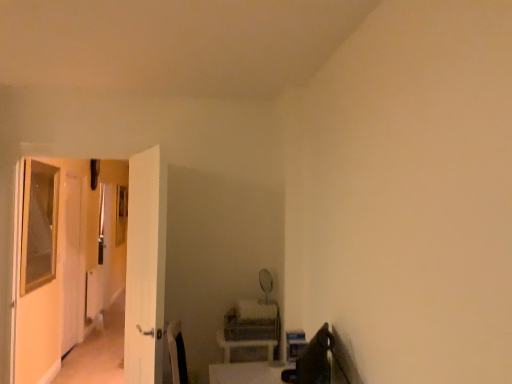
Question: Does green fabric swivel chair at lower right have a smaller size compared to white glossy door at left, which is the second screen door in back-to-front order?

Choices:
 (A) yes
 (B) no

Answer: (A)

Question: From a real-world perspective, is green fabric swivel chair at lower right positioned over white glossy door at left, which is the second screen door in back-to-front order, based on gravity?

Choices:
 (A) no
 (B) yes

Answer: (A)

Question: Is green fabric swivel chair at lower right turned away from white glossy door at left, which is the second screen door in back-to-front order?

Choices:
 (A) yes
 (B) no

Answer: (B)

Question: Considering the relative sizes of green fabric swivel chair at lower right and white glossy door at left, placed as the first screen door when sorted from front to back, in the image provided, is green fabric swivel chair at lower right thinner than white glossy door at left, placed as the first screen door when sorted from front to back,?

Choices:
 (A) yes
 (B) no

Answer: (B)

Question: Is there a large distance between green fabric swivel chair at lower right and white glossy door at left, which is the second screen door in back-to-front order?

Choices:
 (A) no
 (B) yes

Answer: (A)

Question: Do you think green fabric swivel chair at lower right is within white glossy table at lower center, or outside of it?

Choices:
 (A) outside
 (B) inside

Answer: (A)

Question: Considering the positions of green fabric swivel chair at lower right and white glossy table at lower center in the image, is green fabric swivel chair at lower right taller or shorter than white glossy table at lower center?

Choices:
 (A) short
 (B) tall

Answer: (B)

Question: Is green fabric swivel chair at lower right wider or thinner than white glossy table at lower center?

Choices:
 (A) thin
 (B) wide

Answer: (A)

Question: In terms of size, does green fabric swivel chair at lower right appear bigger or smaller than white glossy table at lower center?

Choices:
 (A) big
 (B) small

Answer: (A)

Question: Do you think green fabric swivel chair at lower right is within white glossy door at left, which is the second screen door in back-to-front order, or outside of it?

Choices:
 (A) inside
 (B) outside

Answer: (B)

Question: In terms of width, does green fabric swivel chair at lower right look wider or thinner when compared to white glossy door at left, which is the second screen door in back-to-front order?

Choices:
 (A) thin
 (B) wide

Answer: (B)

Question: Relative to white glossy door at left, placed as the first screen door when sorted from front to back, is green fabric swivel chair at lower right in front or behind?

Choices:
 (A) behind
 (B) front

Answer: (B)

Question: In the image, is green fabric swivel chair at lower right on the left side or the right side of white glossy door at left, marked as the 2th screen door in a left-to-right arrangement?

Choices:
 (A) left
 (B) right

Answer: (B)

Question: Considering the positions of clear glass screen door at left, which is the 2th screen door in front-to-back order, and white glossy table at lower center in the image, is clear glass screen door at left, which is the 2th screen door in front-to-back order, wider or thinner than white glossy table at lower center?

Choices:
 (A) wide
 (B) thin

Answer: (B)

Question: Visually, is clear glass screen door at left, which is the first screen door from left to right, positioned to the left or to the right of white glossy table at lower center?

Choices:
 (A) right
 (B) left

Answer: (B)